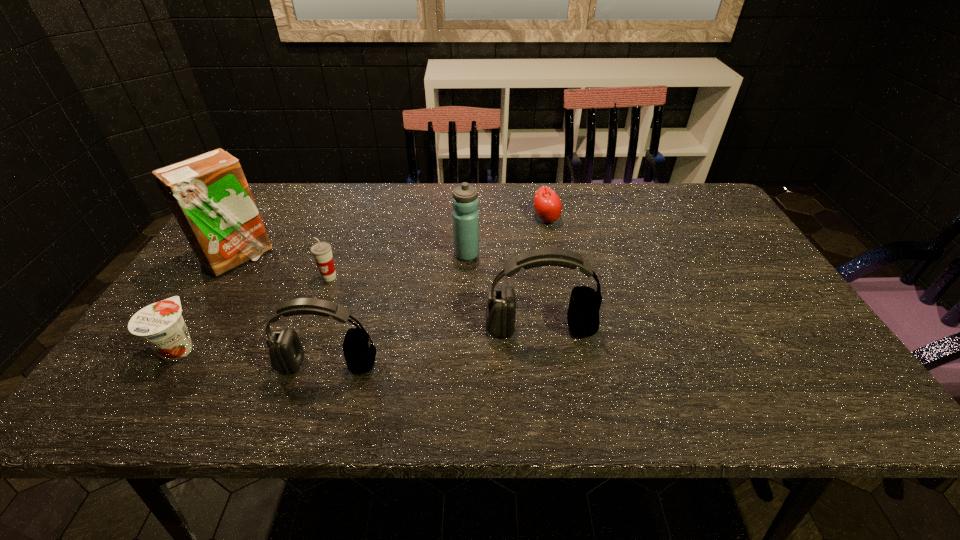
Identify which object is the fifth nearest to the apple. Please provide its 2D coordinates. Your answer should be formatted as a tuple, i.e. [(x, y)], where the tuple contains the x and y coordinates of a point satisfying the conditions above.

[(208, 194)]

Find the location of a particular element. This screenshot has height=540, width=960. free space that satisfies the following two spatial constraints: 1. on the front side of the third object from right to left; 2. on the straw side of the tallest object is located at coordinates (467, 258).

You are a GUI agent. You are given a task and a screenshot of the screen. Output one action in this format:
    pyautogui.click(x=<x>, y=<y>)
    Task: Click on the free region that satisfies the following two spatial constraints: 1. on the back side of the farthest object; 2. on the left side of the yogurt
    This screenshot has height=540, width=960.
    Given the screenshot: What is the action you would take?
    pyautogui.click(x=261, y=219)